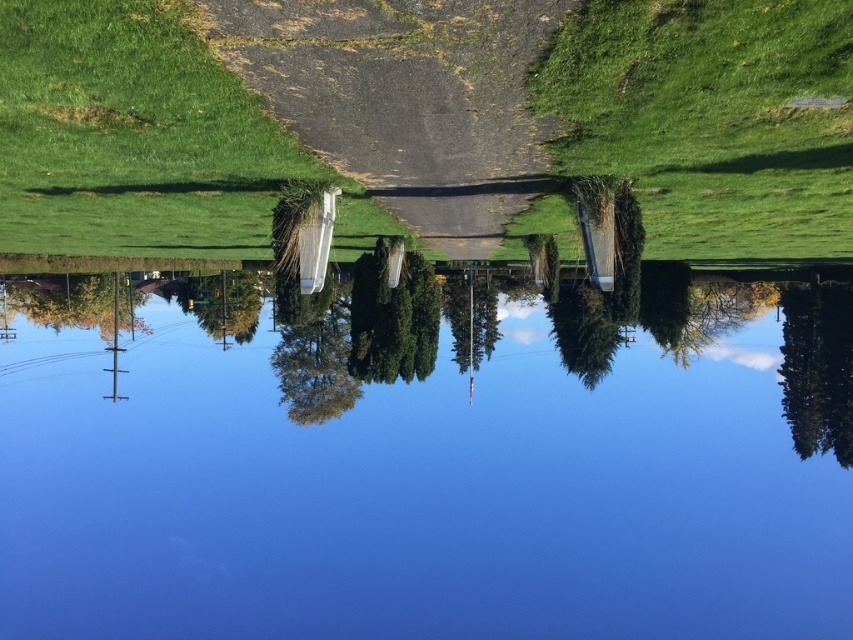
This screenshot has width=853, height=640. I want to click on green grassy at upper right, so click(711, 118).

Where is `green grassy at upper right`? The height and width of the screenshot is (640, 853). green grassy at upper right is located at coordinates (711, 118).

Who is higher up, blue glass lake at center or gravelly asphalt path at center?

gravelly asphalt path at center

Is blue glass lake at center smaller than gravelly asphalt path at center?

No.

Is point (444, 378) more distant than point (467, 240)?

Yes, point (444, 378) is farther from viewer.

This screenshot has height=640, width=853. Identify the location of blue glass lake at center. (425, 458).

Identify the location of blue glass lake at center. (425, 458).

Is blue glass lake at center taller than green grass at upper left?

Yes.

In order to click on blue glass lake at center in this screenshot , I will do `click(425, 458)`.